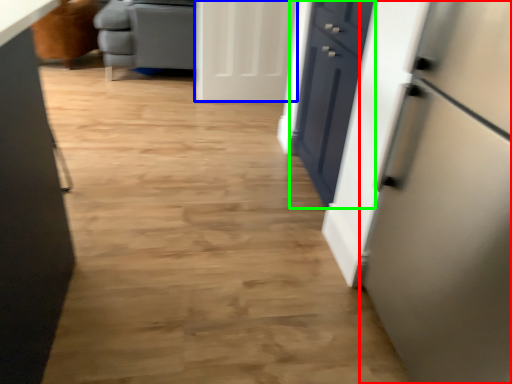
Question: Which object is positioned farthest from refrigerator (highlighted by a red box)? Select from door (highlighted by a blue box) and drawer (highlighted by a green box).

Choices:
 (A) door
 (B) drawer

Answer: (A)